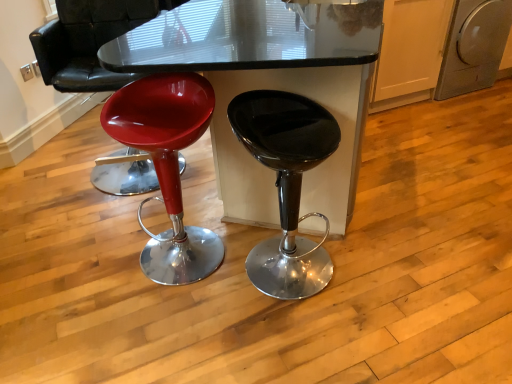
Question: Is glossy plastic stool at left, the first stool viewed from the left, wider or thinner than glossy plastic stool at left?

Choices:
 (A) thin
 (B) wide

Answer: (A)

Question: In terms of size, does glossy plastic stool at left, the first stool viewed from the left, appear bigger or smaller than glossy plastic stool at left?

Choices:
 (A) small
 (B) big

Answer: (A)

Question: Which object is positioned closest to the glossy glass table at center?

Choices:
 (A) silver metallic dishwasher at right
 (B) glossy plastic stool at left, the first stool viewed from the left
 (C) glossy plastic stool at left
 (D) glossy black stool at center, arranged as the 2th stool when viewed from the left

Answer: (A)

Question: Which is farther from the glossy black stool at center, arranged as the 2th stool when viewed from the left?

Choices:
 (A) silver metallic dishwasher at right
 (B) glossy plastic stool at left
 (C) glossy plastic stool at left, the first stool viewed from the left
 (D) glossy glass table at center

Answer: (D)